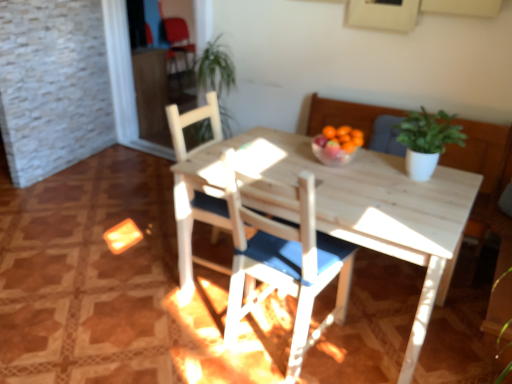
Question: Which direction should I rotate to look at white wood chair at center, the second chair when ordered from back to front?

Choices:
 (A) right
 (B) left

Answer: (A)

Question: Is there a large distance between white wood chair at center, the second chair when ordered from back to front, and white wood chair at center, the first chair positioned from the back?

Choices:
 (A) no
 (B) yes

Answer: (A)

Question: Is white wood chair at center, the 1th chair viewed from the front, smaller than white wood chair at center, the first chair positioned from the back?

Choices:
 (A) no
 (B) yes

Answer: (A)

Question: From a real-world perspective, is white wood chair at center, the second chair when ordered from back to front, below white wood chair at center, arranged as the second chair when viewed from the front?

Choices:
 (A) yes
 (B) no

Answer: (B)

Question: Is white wood chair at center, the 1th chair viewed from the front, directly adjacent to white wood chair at center, the first chair positioned from the back?

Choices:
 (A) yes
 (B) no

Answer: (B)

Question: Is white wood chair at center, the second chair when ordered from back to front, positioned with its back to white wood chair at center, arranged as the second chair when viewed from the front?

Choices:
 (A) no
 (B) yes

Answer: (A)

Question: From a real-world perspective, is white wood chair at center, the 1th chair viewed from the front, physically above white wood chair at center, the first chair positioned from the back?

Choices:
 (A) no
 (B) yes

Answer: (B)

Question: Can you confirm if green matte plant at upper right is bigger than white wood chair at center, the second chair when ordered from back to front?

Choices:
 (A) yes
 (B) no

Answer: (B)

Question: Could you tell me if green matte plant at upper right is facing white wood chair at center, the second chair when ordered from back to front?

Choices:
 (A) no
 (B) yes

Answer: (A)

Question: Is the position of green matte plant at upper right less distant than that of white wood chair at center, the 1th chair viewed from the front?

Choices:
 (A) yes
 (B) no

Answer: (B)

Question: Is green matte plant at upper right far away from white wood chair at center, the 1th chair viewed from the front?

Choices:
 (A) yes
 (B) no

Answer: (B)

Question: Would you say green matte plant at upper right is outside white wood chair at center, the 1th chair viewed from the front?

Choices:
 (A) no
 (B) yes

Answer: (B)

Question: From the image's perspective, is green matte plant at upper right under white wood chair at center, the 1th chair viewed from the front?

Choices:
 (A) yes
 (B) no

Answer: (B)

Question: Does matte red armchair at upper left have a lesser height compared to white wood chair at center, the second chair when ordered from back to front?

Choices:
 (A) yes
 (B) no

Answer: (A)